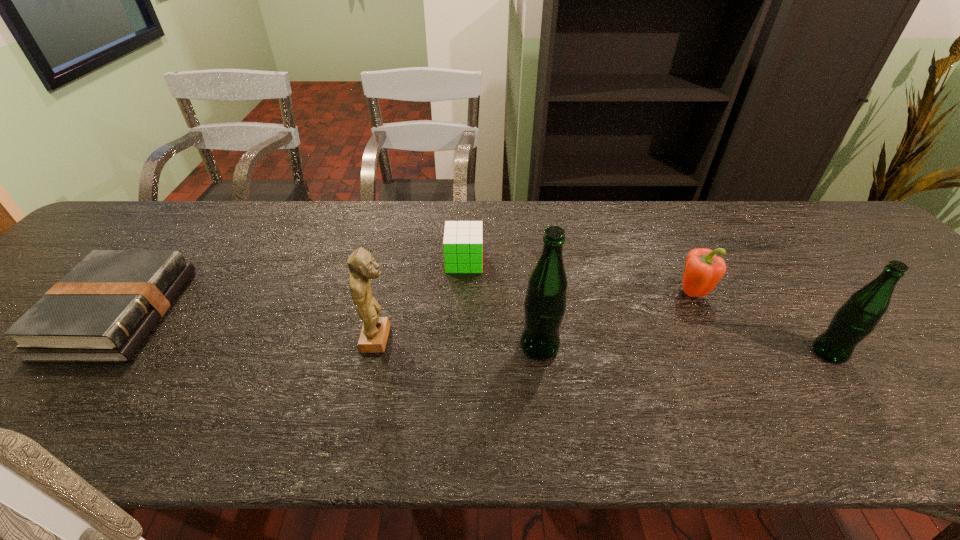
Locate an element on the screen. This screenshot has width=960, height=540. the taller beer bottle is located at coordinates (545, 303).

You are a GUI agent. You are given a task and a screenshot of the screen. Output one action in this format:
    pyautogui.click(x=<x>, y=<y>)
    Task: Click on the tallest object
    The height and width of the screenshot is (540, 960).
    Given the screenshot: What is the action you would take?
    pyautogui.click(x=545, y=303)

This screenshot has height=540, width=960. Identify the location of the rightmost object. (859, 315).

Where is `the right beer bottle`? the right beer bottle is located at coordinates (859, 315).

I want to click on the second shortest object, so click(463, 240).

In order to click on cube in this screenshot , I will do `click(463, 240)`.

Where is `hardback book`? hardback book is located at coordinates (102, 311).

The image size is (960, 540). I want to click on the shortest object, so click(x=102, y=311).

Locate an element on the screen. This screenshot has width=960, height=540. the fourth tallest object is located at coordinates (703, 269).

In order to click on pepper in this screenshot , I will do `click(703, 269)`.